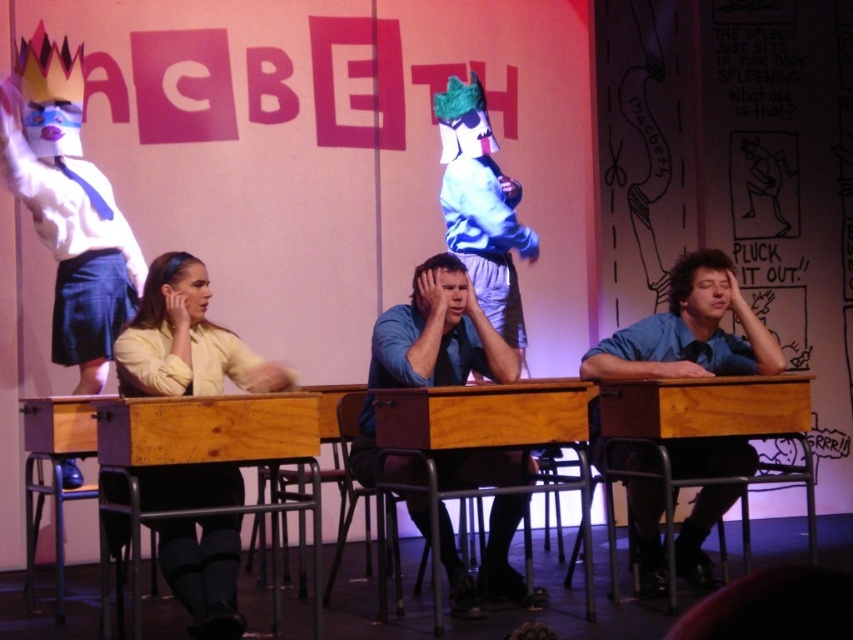
Question: Among these points, which one is nearest to the camera?

Choices:
 (A) (461, 593)
 (B) (683, 531)

Answer: (A)

Question: Where is blue shirt at right located in relation to blue shirt at center in the image?

Choices:
 (A) left
 (B) right

Answer: (B)

Question: Estimate the real-world distances between objects in this image. Which object is closer to the blue shirt at center?

Choices:
 (A) blue shirt at right
 (B) yellow shirt at center

Answer: (B)

Question: Which object is the closest to the blue shirt at right?

Choices:
 (A) blue shirt at center
 (B) yellow shirt at center

Answer: (A)

Question: From the image, what is the correct spatial relationship of yellow shirt at center in relation to blue shirt at right?

Choices:
 (A) above
 (B) below

Answer: (B)

Question: Does blue shirt at right appear on the left side of blue shirt at center?

Choices:
 (A) yes
 (B) no

Answer: (B)